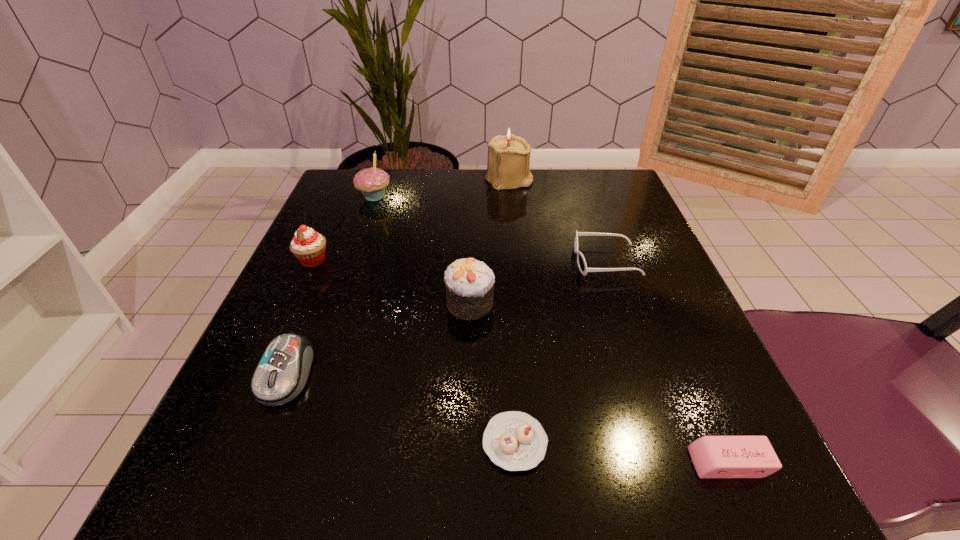
Find the location of a particular element. Image resolution: width=960 pixels, height=540 pixels. candle_holder is located at coordinates (508, 165).

I want to click on the second cupcake from left to right, so click(372, 182).

The height and width of the screenshot is (540, 960). I want to click on the tallest cupcake, so click(372, 182).

Image resolution: width=960 pixels, height=540 pixels. I want to click on the leftmost cupcake, so pyautogui.click(x=308, y=246).

This screenshot has height=540, width=960. What are the coordinates of `the third farthest cupcake` in the screenshot? It's located at (469, 283).

Identify the location of computer mouse. Image resolution: width=960 pixels, height=540 pixels. (282, 373).

Identify the location of the sixth tallest object. click(x=582, y=265).

Find the location of a particular element. The image size is (960, 540). the nearest cupcake is located at coordinates (515, 441).

I want to click on eraser, so click(x=714, y=457).

Where is `free space located 0.150m on the right of the tallest object`? Image resolution: width=960 pixels, height=540 pixels. free space located 0.150m on the right of the tallest object is located at coordinates (594, 180).